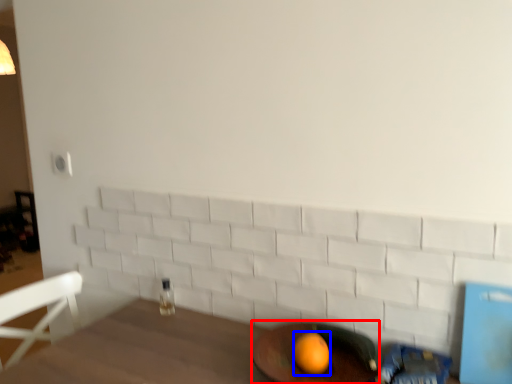
Question: Which point is further to the camera, round table (highlighted by a red box) or orange (highlighted by a blue box)?

Choices:
 (A) round table
 (B) orange

Answer: (B)